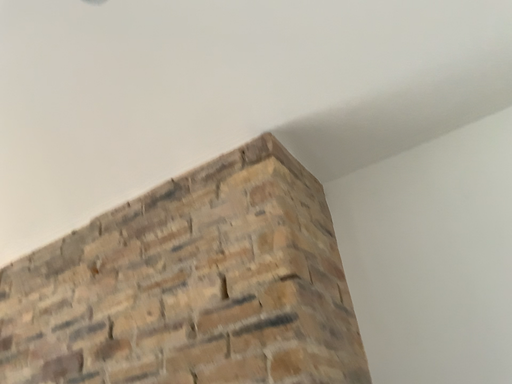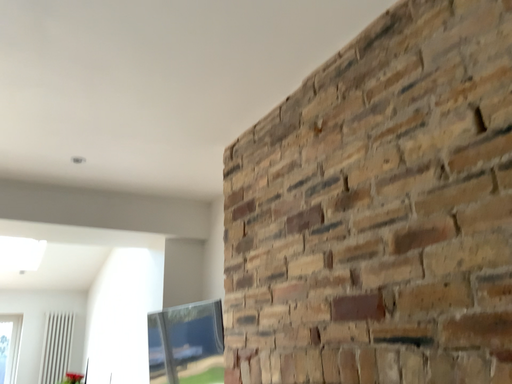
Question: Which way did the camera rotate in the video?

Choices:
 (A) rotated downward
 (B) rotated upward

Answer: (A)